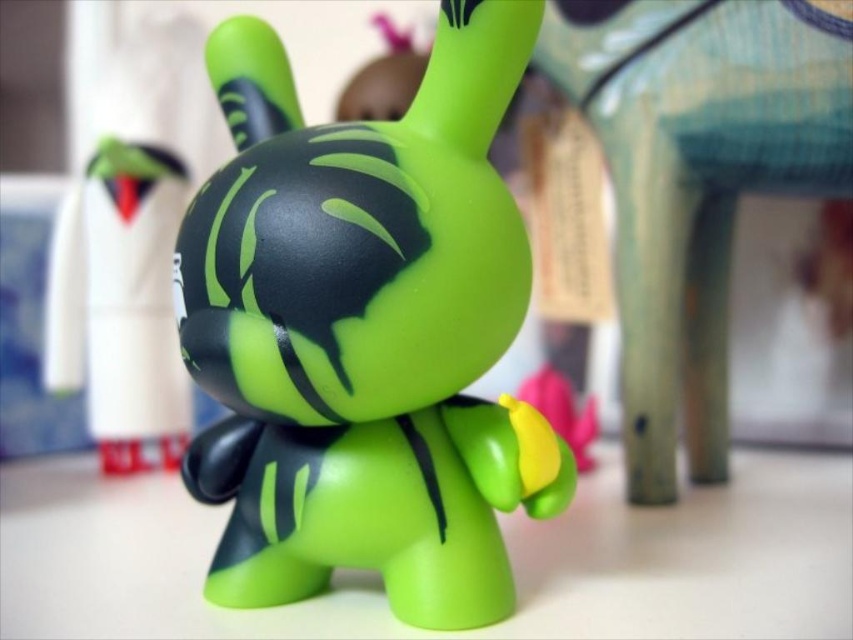
You are looking at the toy figurine display. There are two points marked in the image. The first point is at coordinates point (804, 77) and the second is at point (143, 324). Which of these two points is closer to you?

Point (804, 77) is closer to the viewer than point (143, 324).

You are organizing a toy collection and need to place the matte green plastic toy at center and the green matte toy at center on a shelf. According to the image, which toy should be placed on top to ensure proper display?

The green matte toy at center should be placed on top of the matte green plastic toy at center since the matte green plastic toy at center is positioned under the green matte toy at center in the image.